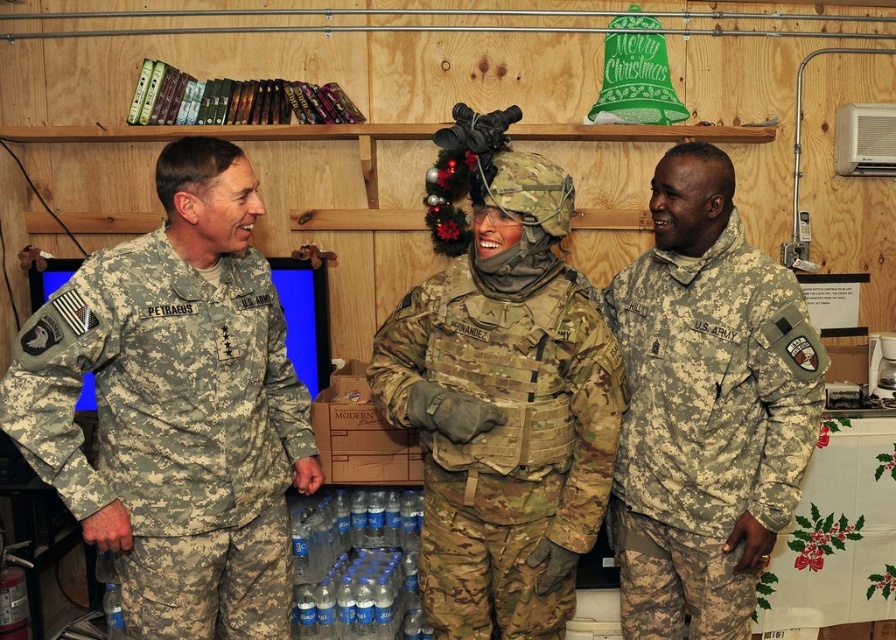
How much distance is there between camouflage fabric uniform at left and camouflage fabric uniform at right?

camouflage fabric uniform at left is 32.29 inches from camouflage fabric uniform at right.

Who is positioned more to the right, camouflage fabric uniform at left or camouflage fabric uniform at right?

camouflage fabric uniform at right

Who is more distant from viewer, [119,330] or [619,273]?

The point [619,273] is more distant.

Locate an element on the screen. Image resolution: width=896 pixels, height=640 pixels. camouflage fabric uniform at left is located at coordinates (171, 429).

How much distance is there between camouflage fabric uniform at left and camouflage fabric uniform at center?

The distance of camouflage fabric uniform at left from camouflage fabric uniform at center is 16.29 inches.

Which is in front, point (263, 296) or point (418, 424)?

Point (418, 424) is in front.

Does point (175, 321) come farther from viewer compared to point (496, 390)?

That is False.

Find the location of a particular element. The width and height of the screenshot is (896, 640). camouflage fabric uniform at left is located at coordinates (x=171, y=429).

I want to click on camouflage fabric uniform at right, so tap(707, 429).

Is camouflage fabric uniform at right wider than camouflage fabric uniform at center?

Incorrect, camouflage fabric uniform at right's width does not surpass camouflage fabric uniform at center's.

Locate an element on the screen. This screenshot has width=896, height=640. camouflage fabric uniform at right is located at coordinates (707, 429).

In order to click on camouflage fabric uniform at right in this screenshot , I will do click(707, 429).